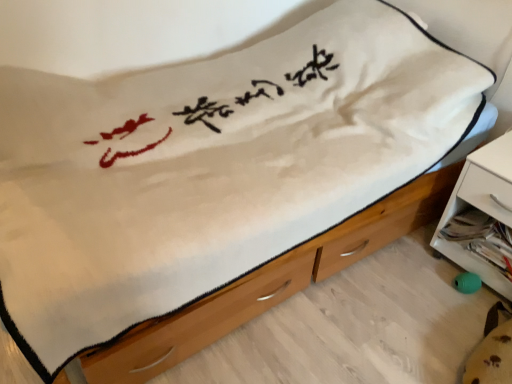
You are a GUI agent. You are given a task and a screenshot of the screen. Output one action in this format:
    pyautogui.click(x=<x>, y=<y>)
    Task: Click on the blank space to the left of white plastic nightstand at lower right
    This screenshot has width=512, height=384.
    Given the screenshot: What is the action you would take?
    pyautogui.click(x=411, y=280)